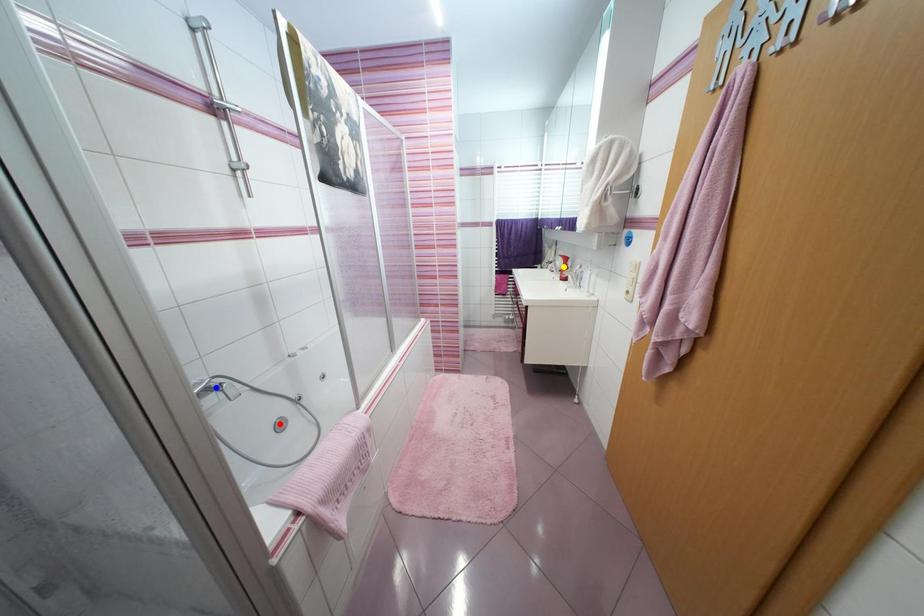
In the scene shown: Order these from nearest to farthest:
blue point, red point, yellow point

blue point
red point
yellow point